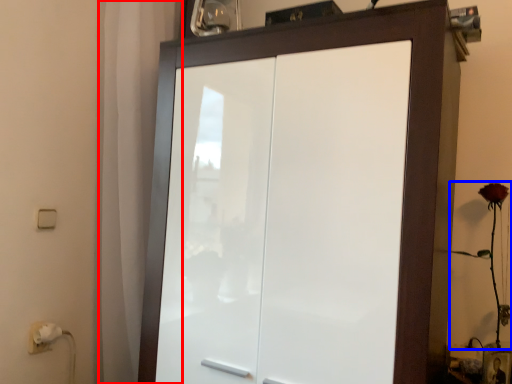
Question: Which object appears farthest to the camera in this image, curtain (highlighted by a red box) or flower (highlighted by a blue box)?

Choices:
 (A) curtain
 (B) flower

Answer: (A)